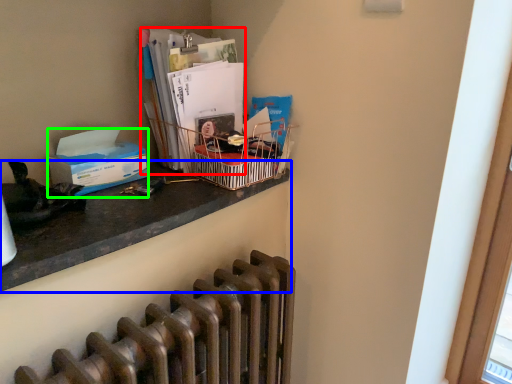
Question: Which object is the farthest from magazine (highlighted by a red box)? Choose among these: desk (highlighted by a blue box) or box (highlighted by a green box).

Choices:
 (A) desk
 (B) box

Answer: (A)